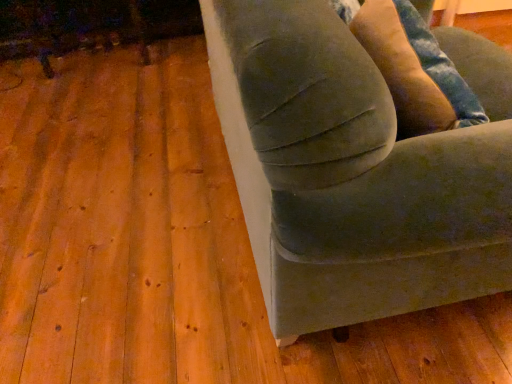
Find the location of a particular element. velvet green armchair at upper right is located at coordinates (356, 170).

What do you see at coordinates (356, 170) in the screenshot? The image size is (512, 384). I see `velvet green armchair at upper right` at bounding box center [356, 170].

You are a GUI agent. You are given a task and a screenshot of the screen. Output one action in this format:
    pyautogui.click(x=<x>, y=<y>)
    Task: Click on the velvet green armchair at upper right
    
    Given the screenshot: What is the action you would take?
    pyautogui.click(x=356, y=170)